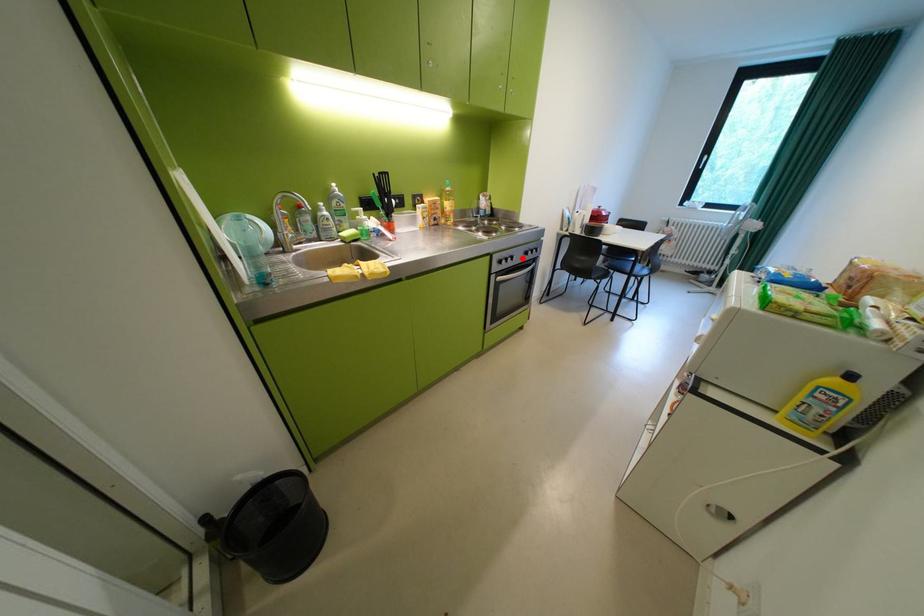
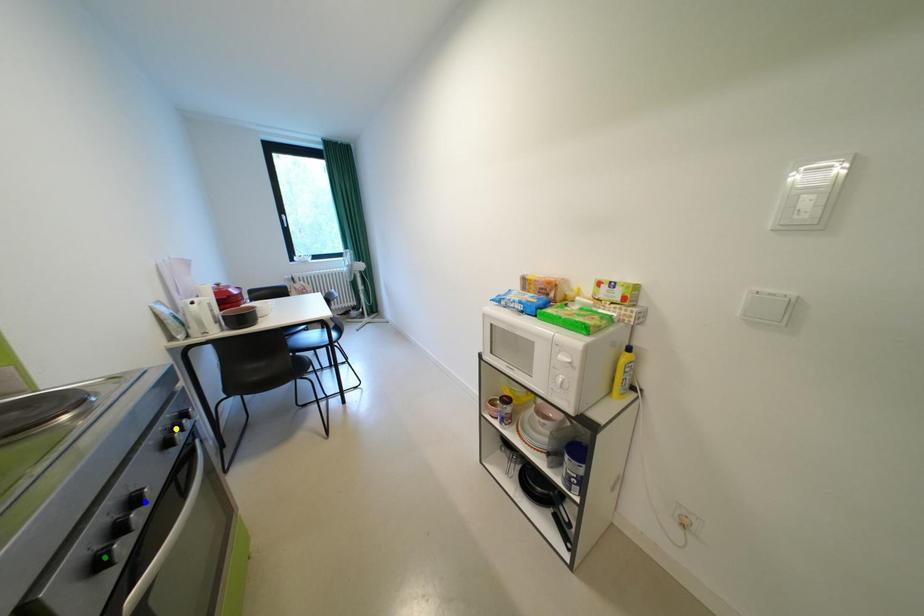
Question: I am providing you with two images of the same scene from different viewpoints. A red point is marked on the first image. You are given multiple points on the second image. Can you choose the point in image 2 that corresponds to the point in image 1?

Choices:
 (A) blue point
 (B) yellow point
 (C) green point

Answer: (A)